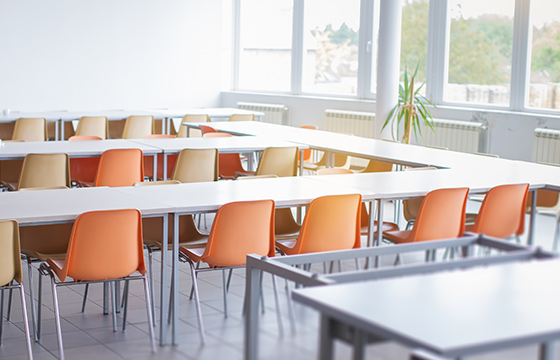
Locate an element on the screen. windows is located at coordinates (542, 52), (490, 58), (415, 44), (342, 51), (284, 59).